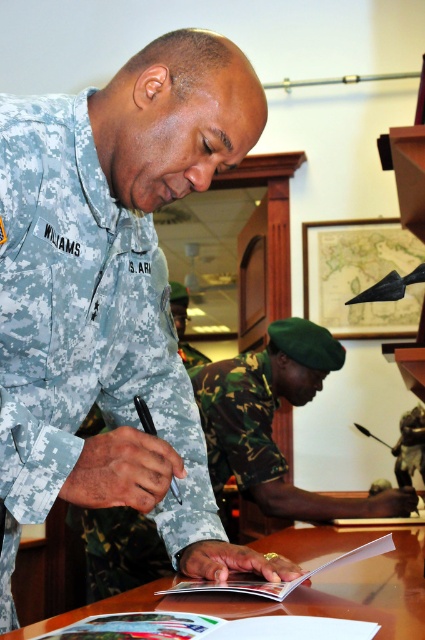
Question: Does camouflage uniform at center have a greater width compared to brown wooden table at center?

Choices:
 (A) yes
 (B) no

Answer: (B)

Question: In this image, where is camouflage fabric uniform at center located relative to brown wooden table at center?

Choices:
 (A) below
 (B) above

Answer: (B)

Question: Does camouflage uniform at center have a lesser width compared to brown wooden table at center?

Choices:
 (A) no
 (B) yes

Answer: (B)

Question: Which point is farther from the camera taking this photo?

Choices:
 (A) (252, 392)
 (B) (399, 532)
 (C) (17, 529)

Answer: (A)

Question: Among these points, which one is farthest from the camera?

Choices:
 (A) (294, 532)
 (B) (164, 275)
 (C) (319, 376)

Answer: (C)

Question: Which point is closer to the camera?

Choices:
 (A) camouflage uniform at center
 (B) camouflage fabric uniform at center

Answer: (B)